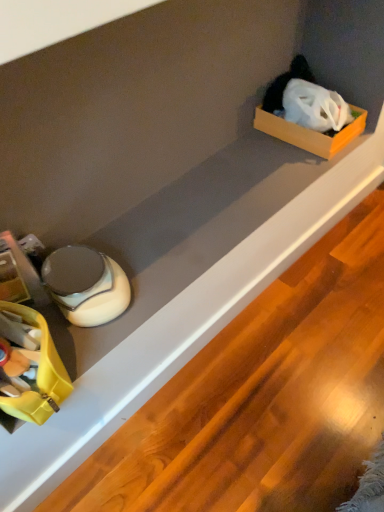
Measure the distance between point (55, 355) and camera.

Point (55, 355) and camera are 32.17 inches apart.

Locate an element on the screen. yellow plastic storage box at lower left is located at coordinates (44, 355).

What is the approximate width of yellow plastic storage box at lower left?

yellow plastic storage box at lower left is 30.86 centimeters wide.

What do you see at coordinates (44, 355) in the screenshot? I see `yellow plastic storage box at lower left` at bounding box center [44, 355].

Locate an element on the screen. This screenshot has height=512, width=384. orange cardboard box at upper right is located at coordinates (311, 132).

What do you see at coordinates (311, 132) in the screenshot?
I see `orange cardboard box at upper right` at bounding box center [311, 132].

This screenshot has width=384, height=512. Find the location of `yellow plastic storage box at lower left`. yellow plastic storage box at lower left is located at coordinates (44, 355).

Can you confirm if orange cardboard box at upper right is positioned to the left of yellow plastic storage box at lower left?

No, orange cardboard box at upper right is not to the left of yellow plastic storage box at lower left.

Considering the relative positions of orange cardboard box at upper right and yellow plastic storage box at lower left in the image provided, is orange cardboard box at upper right in front of yellow plastic storage box at lower left?

No, orange cardboard box at upper right is further to the viewer.

Is point (292, 130) behind point (52, 398)?

Yes.

From the image's perspective, between orange cardboard box at upper right and yellow plastic storage box at lower left, who is located below?

yellow plastic storage box at lower left.

From a real-world perspective, relative to yellow plastic storage box at lower left, is orange cardboard box at upper right vertically above or below?

From a real-world perspective, orange cardboard box at upper right is physically below yellow plastic storage box at lower left.

Looking at their sizes, would you say orange cardboard box at upper right is wider or thinner than yellow plastic storage box at lower left?

orange cardboard box at upper right is thinner than yellow plastic storage box at lower left.

Between orange cardboard box at upper right and yellow plastic storage box at lower left, which one has more height?

Answer: yellow plastic storage box at lower left.

Considering the sizes of objects orange cardboard box at upper right and yellow plastic storage box at lower left in the image provided, who is bigger, orange cardboard box at upper right or yellow plastic storage box at lower left?

yellow plastic storage box at lower left.

Is orange cardboard box at upper right surrounding yellow plastic storage box at lower left?

No, yellow plastic storage box at lower left is not inside orange cardboard box at upper right.

Is orange cardboard box at upper right touching yellow plastic storage box at lower left?

orange cardboard box at upper right and yellow plastic storage box at lower left are not in contact.

Is yellow plastic storage box at lower left at the back of orange cardboard box at upper right?

orange cardboard box at upper right is not turned away from yellow plastic storage box at lower left.

Identify the location of storage box above the orange cardboard box at upper right (from a real-world perspective). (44, 355).

Is yellow plastic storage box at lower left at the left side of orange cardboard box at upper right?

Yes.

Who is more distant, yellow plastic storage box at lower left or orange cardboard box at upper right?

Positioned behind is orange cardboard box at upper right.

Between point (45, 408) and point (331, 134), which one is positioned behind?

The point (331, 134) is farther from the camera.

From the image's perspective, is yellow plastic storage box at lower left on top of orange cardboard box at upper right?

No, from the image's perspective, yellow plastic storage box at lower left is not over orange cardboard box at upper right.

From a real-world perspective, which is physically below, yellow plastic storage box at lower left or orange cardboard box at upper right?

In real-world perspective, orange cardboard box at upper right is lower.

Considering the relative sizes of yellow plastic storage box at lower left and orange cardboard box at upper right in the image provided, is yellow plastic storage box at lower left thinner than orange cardboard box at upper right?

No, yellow plastic storage box at lower left is not thinner than orange cardboard box at upper right.

Considering the sizes of objects yellow plastic storage box at lower left and orange cardboard box at upper right in the image provided, who is shorter, yellow plastic storage box at lower left or orange cardboard box at upper right?

orange cardboard box at upper right is shorter.

Considering the relative sizes of yellow plastic storage box at lower left and orange cardboard box at upper right in the image provided, is yellow plastic storage box at lower left bigger than orange cardboard box at upper right?

Correct, yellow plastic storage box at lower left is larger in size than orange cardboard box at upper right.

Would you say orange cardboard box at upper right is part of yellow plastic storage box at lower left's contents?

That's incorrect, orange cardboard box at upper right is not inside yellow plastic storage box at lower left.

Is yellow plastic storage box at lower left far away from orange cardboard box at upper right?

No, yellow plastic storage box at lower left is in close proximity to orange cardboard box at upper right.

Is yellow plastic storage box at lower left aimed at orange cardboard box at upper right?

No, yellow plastic storage box at lower left is not oriented towards orange cardboard box at upper right.

How much distance is there between yellow plastic storage box at lower left and orange cardboard box at upper right?

38.17 inches.

Locate an element on the screen. box located behind the yellow plastic storage box at lower left is located at coordinates (311, 132).

Find the location of `storage box in front of the orange cardboard box at upper right`. storage box in front of the orange cardboard box at upper right is located at coordinates (44, 355).

I want to click on box located behind the yellow plastic storage box at lower left, so [x=311, y=132].